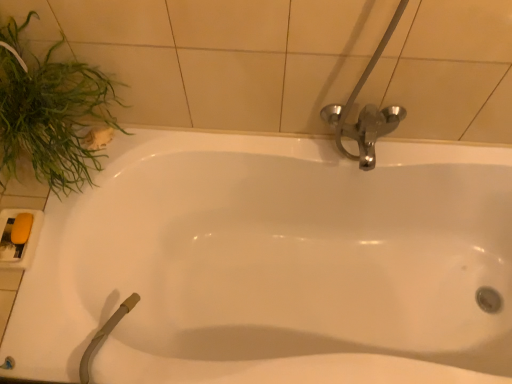
Question: From the image's perspective, does green leafy plant at left appear lower than white glossy bathtub at center?

Choices:
 (A) no
 (B) yes

Answer: (A)

Question: Could you tell me if green leafy plant at left is facing white glossy bathtub at center?

Choices:
 (A) yes
 (B) no

Answer: (B)

Question: Is green leafy plant at left not close to white glossy bathtub at center?

Choices:
 (A) no
 (B) yes

Answer: (A)

Question: Considering the relative sizes of green leafy plant at left and white glossy bathtub at center in the image provided, is green leafy plant at left bigger than white glossy bathtub at center?

Choices:
 (A) no
 (B) yes

Answer: (A)

Question: Would you say green leafy plant at left is outside white glossy bathtub at center?

Choices:
 (A) yes
 (B) no

Answer: (A)

Question: In terms of height, does green leafy plant at left look taller or shorter compared to white glossy bathtub at center?

Choices:
 (A) short
 (B) tall

Answer: (A)

Question: Looking at the image, does green leafy plant at left seem bigger or smaller compared to white glossy bathtub at center?

Choices:
 (A) big
 (B) small

Answer: (B)

Question: Relative to white glossy bathtub at center, is green leafy plant at left in front or behind?

Choices:
 (A) front
 (B) behind

Answer: (A)

Question: Choose the correct answer: Is green leafy plant at left inside white glossy bathtub at center or outside it?

Choices:
 (A) inside
 (B) outside

Answer: (B)

Question: Considering the positions of white glossy bathtub at center and yellow matte soap at lower left in the image, is white glossy bathtub at center bigger or smaller than yellow matte soap at lower left?

Choices:
 (A) big
 (B) small

Answer: (A)

Question: Is white glossy bathtub at center inside the boundaries of yellow matte soap at lower left, or outside?

Choices:
 (A) inside
 (B) outside

Answer: (B)

Question: Is white glossy bathtub at center in front of or behind yellow matte soap at lower left in the image?

Choices:
 (A) front
 (B) behind

Answer: (A)

Question: Is white glossy bathtub at center taller or shorter than yellow matte soap at lower left?

Choices:
 (A) tall
 (B) short

Answer: (A)

Question: Looking at the image, does yellow matte soap at lower left seem bigger or smaller compared to green leafy plant at left?

Choices:
 (A) small
 (B) big

Answer: (A)

Question: Relative to green leafy plant at left, is yellow matte soap at lower left in front or behind?

Choices:
 (A) behind
 (B) front

Answer: (A)